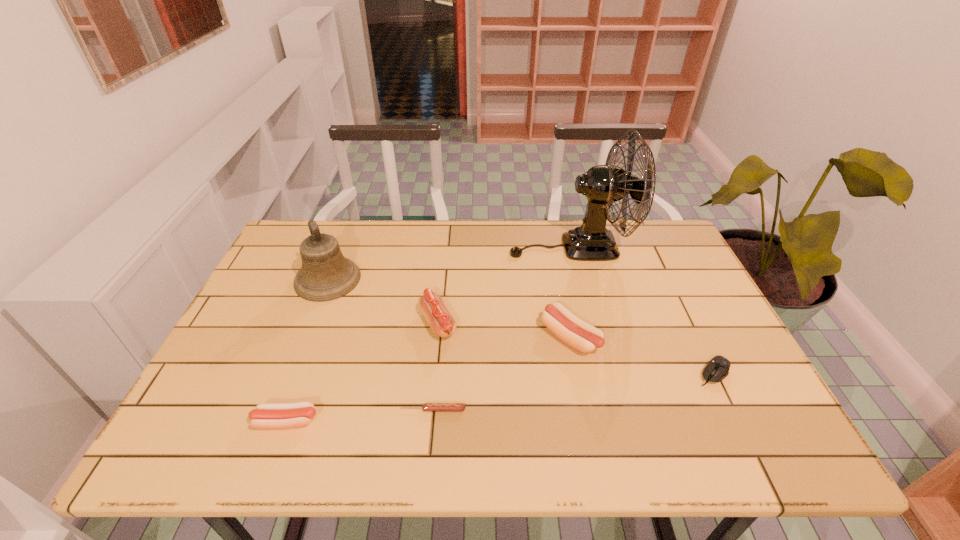
Find the location of `fan`. fan is located at coordinates (603, 185).

Where is `the sixth shortest object`? the sixth shortest object is located at coordinates (325, 275).

This screenshot has height=540, width=960. Find the location of `the rightmost sausage`. the rightmost sausage is located at coordinates (582, 336).

Identify the location of the third shortest object. (266, 415).

I want to click on the leftmost sausage, so click(x=266, y=415).

Where is `the rightmost object`? This screenshot has height=540, width=960. the rightmost object is located at coordinates (717, 369).

Locate an element on the screen. computer mouse is located at coordinates (717, 369).

Locate an element on the screen. the shortest sausage is located at coordinates (426, 406).

Where is `vacant area situated in front of the tallest object, indicating the direction of air flow`? Image resolution: width=960 pixels, height=540 pixels. vacant area situated in front of the tallest object, indicating the direction of air flow is located at coordinates (433, 247).

At what (x,y) coordinates should I click in order to perform the action: click on blank area located 0.220m in front of the tallest object, indicating the direction of air flow. Please return your answer as a coordinate pair (x, y). The width and height of the screenshot is (960, 540). Looking at the image, I should click on (440, 247).